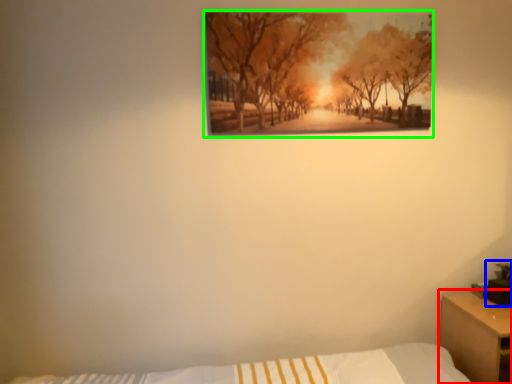
Question: Based on their relative distances, which object is nearer to nightstand (highlighted by a red box)? Choose from table lamp (highlighted by a blue box) and picture frame (highlighted by a green box).

Choices:
 (A) table lamp
 (B) picture frame

Answer: (A)